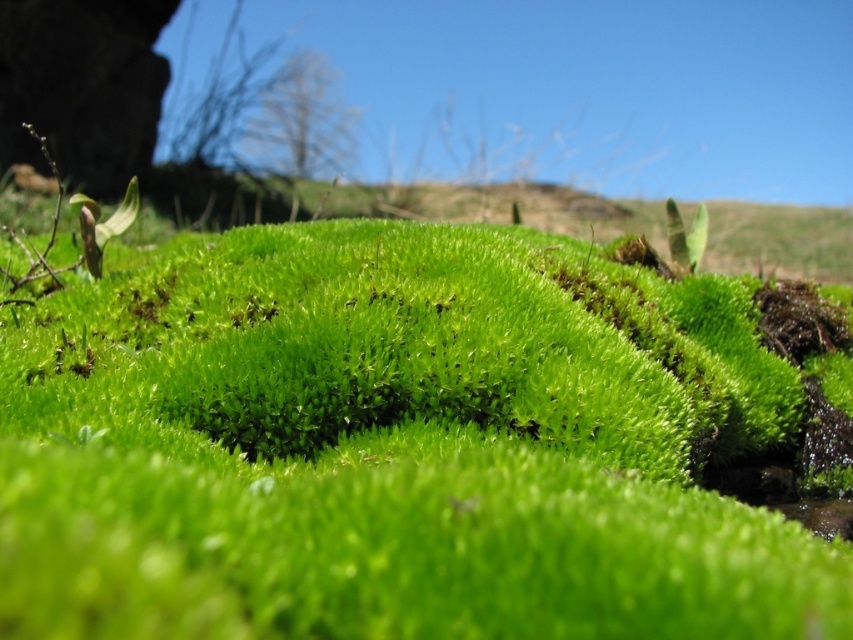
Is point (323, 493) positioned before point (86, 268)?

Yes, it is.

Can you confirm if green soft moss at center is taller than green fuzzy moss at center?

Indeed, green soft moss at center has a greater height compared to green fuzzy moss at center.

Image resolution: width=853 pixels, height=640 pixels. I want to click on green soft moss at center, so click(x=416, y=442).

Identify the location of green soft moss at center. The image size is (853, 640). (416, 442).